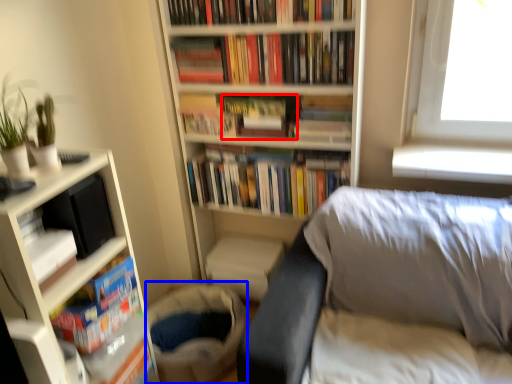
Question: Which of the following is the closest to the observer, paperback book (highlighted by a red box) or gray (highlighted by a blue box)?

Choices:
 (A) paperback book
 (B) gray

Answer: (B)